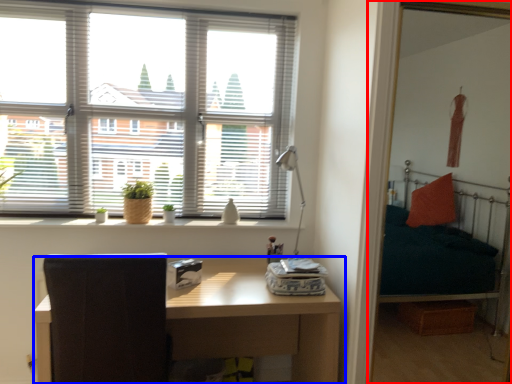
Question: Which point is closer to the camera, bunk bed (highlighted by a red box) or table (highlighted by a blue box)?

Choices:
 (A) bunk bed
 (B) table

Answer: (B)